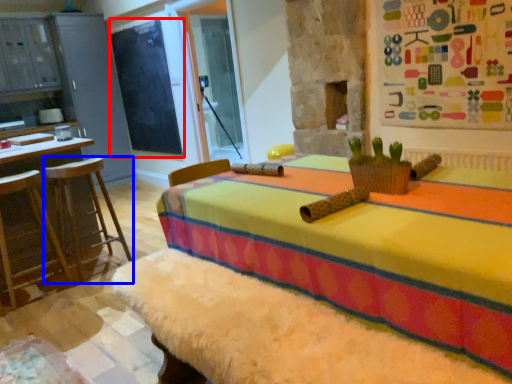
Question: Which point is closer to the camera, bulletin board (highlighted by a red box) or furniture (highlighted by a blue box)?

Choices:
 (A) bulletin board
 (B) furniture

Answer: (B)